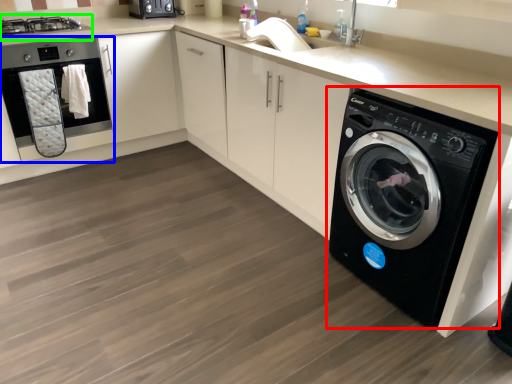
Question: Based on their relative distances, which object is farther from washing machine (highlighted by a red box)? Choose from home appliance (highlighted by a blue box) and stove (highlighted by a green box).

Choices:
 (A) home appliance
 (B) stove

Answer: (B)